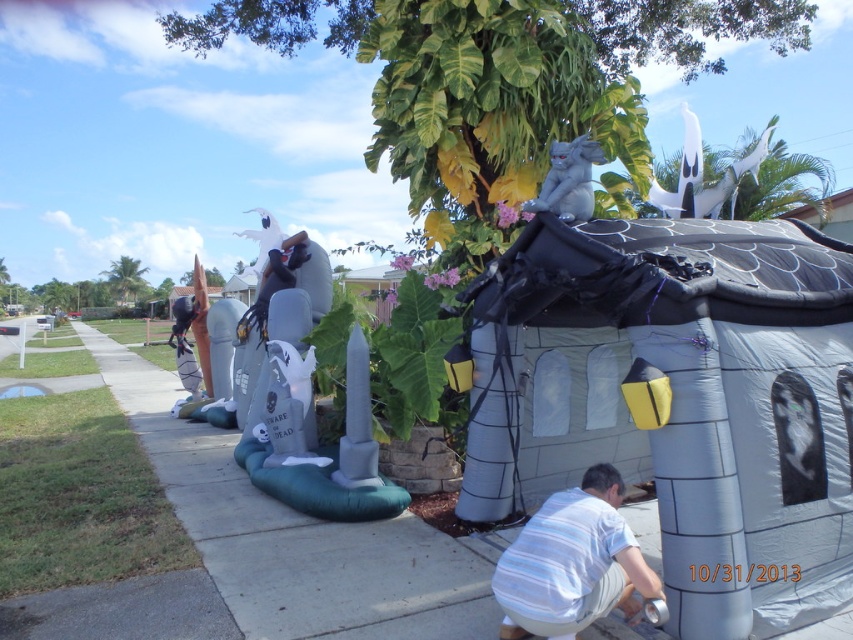
Is white glossy ghost at upper center wider than gray matte statue at upper center?

Correct, the width of white glossy ghost at upper center exceeds that of gray matte statue at upper center.

Between white glossy ghost at upper center and gray matte statue at upper center, which one is positioned higher?

white glossy ghost at upper center

Is point (730, 188) closer to camera compared to point (578, 208)?

That is False.

This screenshot has width=853, height=640. What are the coordinates of `white glossy ghost at upper center` in the screenshot? It's located at (701, 176).

Does gray concrete sidewalk at lower left have a greater height compared to gray matte statue at upper center?

Incorrect, gray concrete sidewalk at lower left's height is not larger of gray matte statue at upper center's.

Can you confirm if gray concrete sidewalk at lower left is positioned to the right of gray matte statue at upper center?

In fact, gray concrete sidewalk at lower left is to the left of gray matte statue at upper center.

Between point (248, 552) and point (564, 150), which one is positioned behind?

Positioned behind is point (564, 150).

Image resolution: width=853 pixels, height=640 pixels. Find the location of `gray concrete sidewalk at lower left`. gray concrete sidewalk at lower left is located at coordinates (296, 536).

Does point (103, 380) come farther from viewer compared to point (363, 448)?

Yes, point (103, 380) is behind point (363, 448).

Does gray concrete sidewalk at lower left appear under inflatable gray at left?

Yes.

Which is behind, point (195, 460) or point (299, 340)?

Positioned behind is point (195, 460).

This screenshot has height=640, width=853. Identify the location of gray concrete sidewalk at lower left. (296, 536).